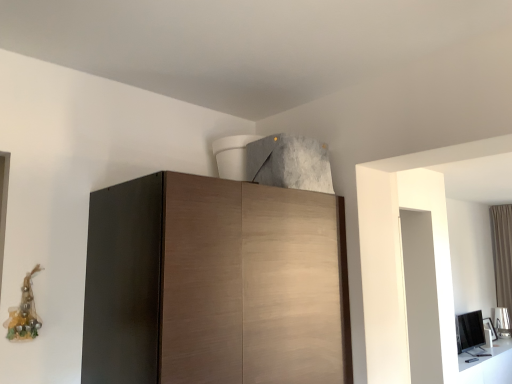
Describe the element at coordinates (214, 284) in the screenshot. I see `wooden cabinet at center` at that location.

Locate an element on the screen. wooden cabinet at center is located at coordinates (214, 284).

This screenshot has width=512, height=384. Describe the element at coordinates (502, 254) in the screenshot. I see `brown fabric curtain at right` at that location.

Where is `brown fabric curtain at right`? The width and height of the screenshot is (512, 384). brown fabric curtain at right is located at coordinates (502, 254).

Find the location of a particular element. This screenshot has height=384, width=512. wooden cabinet at center is located at coordinates (214, 284).

Which is more to the left, brown fabric curtain at right or wooden cabinet at center?

Positioned to the left is wooden cabinet at center.

Considering the positions of objects brown fabric curtain at right and wooden cabinet at center in the image provided, who is behind, brown fabric curtain at right or wooden cabinet at center?

brown fabric curtain at right is further away from the camera.

Which is behind, point (503, 259) or point (256, 260)?

The point (503, 259) is behind.

From the image's perspective, is brown fabric curtain at right located above wooden cabinet at center?

Actually, brown fabric curtain at right appears below wooden cabinet at center in the image.

From a real-world perspective, is brown fabric curtain at right positioned above or below wooden cabinet at center?

brown fabric curtain at right is below wooden cabinet at center.

Looking at their sizes, would you say brown fabric curtain at right is wider or thinner than wooden cabinet at center?

Considering their sizes, brown fabric curtain at right looks slimmer than wooden cabinet at center.

Which of these two, brown fabric curtain at right or wooden cabinet at center, stands taller?

brown fabric curtain at right.

Is brown fabric curtain at right bigger than wooden cabinet at center?

No, brown fabric curtain at right is not bigger than wooden cabinet at center.

Is brown fabric curtain at right spatially inside wooden cabinet at center, or outside of it?

brown fabric curtain at right exists outside the volume of wooden cabinet at center.

Is brown fabric curtain at right next to wooden cabinet at center?

No, brown fabric curtain at right is not with wooden cabinet at center.

Is brown fabric curtain at right looking in the opposite direction of wooden cabinet at center?

No, brown fabric curtain at right is not facing the opposite direction of wooden cabinet at center.

Can you tell me how much brown fabric curtain at right and wooden cabinet at center differ in facing direction?

The angle between the facing direction of brown fabric curtain at right and the facing direction of wooden cabinet at center is 90 degrees.

In the image, there is a wooden cabinet at center. Where is `curtain below it (from the image's perspective)`? The height and width of the screenshot is (384, 512). curtain below it (from the image's perspective) is located at coordinates (502, 254).

Considering the positions of objects wooden cabinet at center and brown fabric curtain at right in the image provided, who is more to the right, wooden cabinet at center or brown fabric curtain at right?

Positioned to the right is brown fabric curtain at right.

Is wooden cabinet at center positioned before brown fabric curtain at right?

Yes, it is in front of brown fabric curtain at right.

Considering the positions of points (222, 365) and (503, 287), is point (222, 365) farther from camera compared to point (503, 287)?

That is False.

From the picture: From the image's perspective, does wooden cabinet at center appear lower than brown fabric curtain at right?

No, from the image's perspective, wooden cabinet at center is not beneath brown fabric curtain at right.

From a real-world perspective, is wooden cabinet at center located higher than brown fabric curtain at right?

Indeed, from a real-world perspective, wooden cabinet at center stands above brown fabric curtain at right.

Between wooden cabinet at center and brown fabric curtain at right, which one has larger width?

wooden cabinet at center is wider.

Does wooden cabinet at center have a lesser height compared to brown fabric curtain at right?

Correct, wooden cabinet at center is not as tall as brown fabric curtain at right.

Considering the relative sizes of wooden cabinet at center and brown fabric curtain at right in the image provided, is wooden cabinet at center bigger than brown fabric curtain at right?

Indeed, wooden cabinet at center has a larger size compared to brown fabric curtain at right.

In the scene shown: Is wooden cabinet at center situated inside brown fabric curtain at right or outside?

wooden cabinet at center exists outside the volume of brown fabric curtain at right.

Based on the photo, is there a large distance between wooden cabinet at center and brown fabric curtain at right?

Yes, wooden cabinet at center is far from brown fabric curtain at right.

Is wooden cabinet at center oriented away from brown fabric curtain at right?

wooden cabinet at center does not have its back to brown fabric curtain at right.

How distant is wooden cabinet at center from brown fabric curtain at right?

They are 6.02 meters apart.

Identify the location of curtain below the wooden cabinet at center (from the image's perspective). Image resolution: width=512 pixels, height=384 pixels. (502, 254).

Image resolution: width=512 pixels, height=384 pixels. What are the coordinates of `curtain located below the wooden cabinet at center (from the image's perspective)` in the screenshot? It's located at (502, 254).

The height and width of the screenshot is (384, 512). Find the location of `curtain behind the wooden cabinet at center`. curtain behind the wooden cabinet at center is located at coordinates (502, 254).